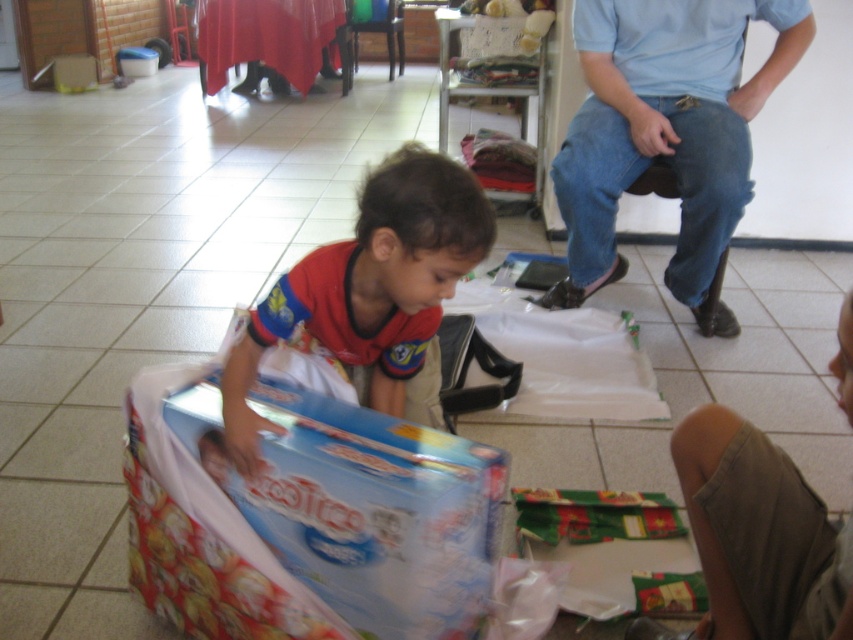
Who is shorter, matte red shirt at center or khaki cotton shorts at lower right?

khaki cotton shorts at lower right

Between point (228, 362) and point (701, 408), which one is positioned in front?

Point (701, 408) is in front.

Locate an element on the screen. matte red shirt at center is located at coordinates (370, 289).

Does blue jeans at upper right have a lesser width compared to khaki cotton shorts at lower right?

No, blue jeans at upper right is not thinner than khaki cotton shorts at lower right.

Does blue jeans at upper right come behind khaki cotton shorts at lower right?

Yes, it is behind khaki cotton shorts at lower right.

This screenshot has height=640, width=853. What do you see at coordinates (664, 129) in the screenshot? I see `blue jeans at upper right` at bounding box center [664, 129].

I want to click on blue jeans at upper right, so click(x=664, y=129).

Between blue jeans at upper right and matte red shirt at center, which one appears on the left side from the viewer's perspective?

matte red shirt at center is more to the left.

How distant is blue jeans at upper right from matte red shirt at center?

3.73 feet

The width and height of the screenshot is (853, 640). What do you see at coordinates (664, 129) in the screenshot?
I see `blue jeans at upper right` at bounding box center [664, 129].

This screenshot has height=640, width=853. Find the location of `blue jeans at upper right`. blue jeans at upper right is located at coordinates (664, 129).